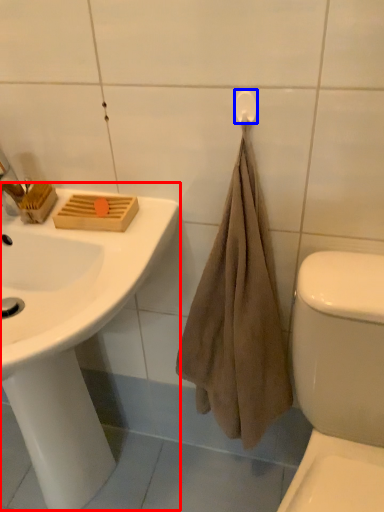
Question: Which object appears closest to the camera in this image, sink (highlighted by a red box) or towel bar (highlighted by a blue box)?

Choices:
 (A) sink
 (B) towel bar

Answer: (A)